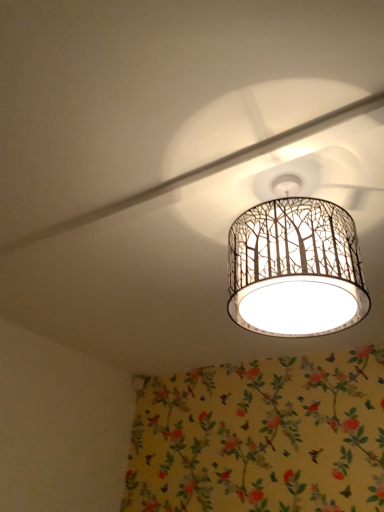
Measure the distance between point (327, 302) and camera.

A distance of 3.72 feet exists between point (327, 302) and camera.

The height and width of the screenshot is (512, 384). In order to click on matte black lampshade at upper center in this screenshot , I will do `click(295, 269)`.

The image size is (384, 512). Describe the element at coordinates (295, 269) in the screenshot. I see `matte black lampshade at upper center` at that location.

What are the coordinates of `matte black lampshade at upper center` in the screenshot? It's located at (295, 269).